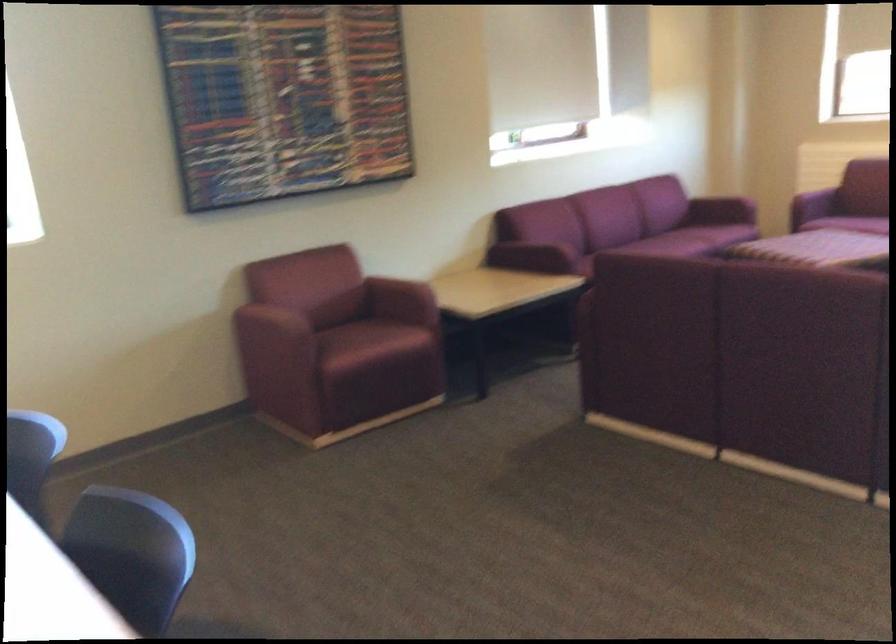
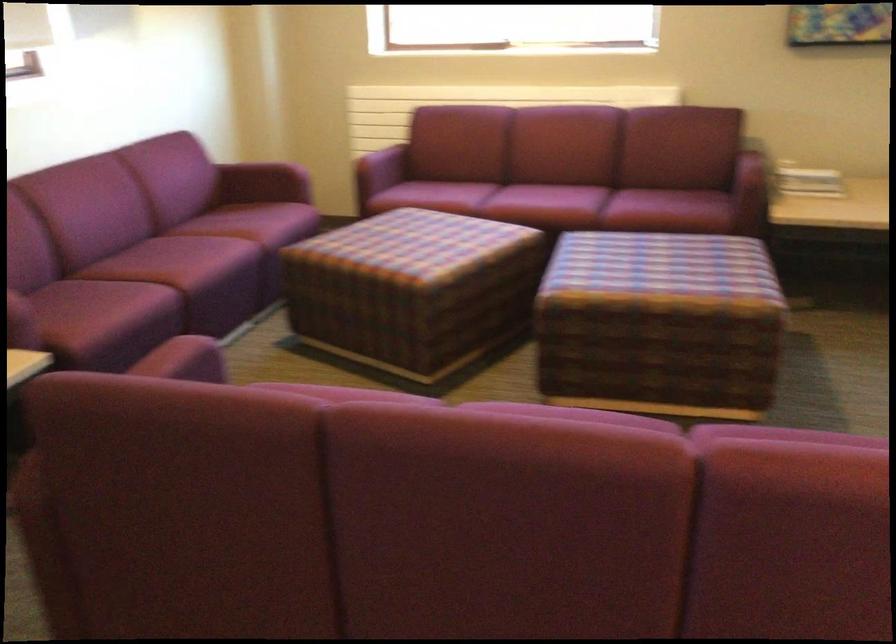
Question: I am providing you with two images of the same scene from different viewpoints. Which of the following objects are not visible in image2?

Choices:
 (A) purple sofa sitting surface
 (B) blue paper card
 (C) stack of papers
 (D) maroon sofa sitting surface

Answer: (D)